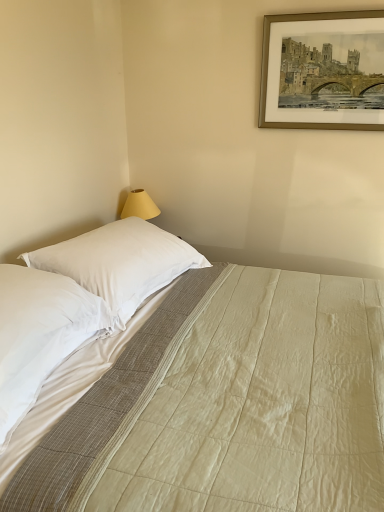
Question: From the image's perspective, is white soft pillow at left, arranged as the first pillow when viewed from the front, located beneath white cotton bed at center?

Choices:
 (A) yes
 (B) no

Answer: (B)

Question: Is the position of white soft pillow at left, which is counted as the 2th pillow, starting from the back, more distant than that of white cotton bed at center?

Choices:
 (A) yes
 (B) no

Answer: (A)

Question: Is white soft pillow at left, arranged as the first pillow when viewed from the front, beside white cotton bed at center?

Choices:
 (A) yes
 (B) no

Answer: (B)

Question: Could you tell me if white soft pillow at left, which is counted as the 2th pillow, starting from the back, is turned towards white cotton bed at center?

Choices:
 (A) yes
 (B) no

Answer: (A)

Question: Considering the relative positions of white soft pillow at left, which is counted as the 2th pillow, starting from the back, and white cotton bed at center in the image provided, is white soft pillow at left, which is counted as the 2th pillow, starting from the back, to the left of white cotton bed at center from the viewer's perspective?

Choices:
 (A) yes
 (B) no

Answer: (A)

Question: Is white soft pillow at left, which is counted as the 2th pillow, starting from the back, bigger than white cotton bed at center?

Choices:
 (A) yes
 (B) no

Answer: (B)

Question: Can white smooth pillow at upper left, which appears as the 2th pillow when viewed from the front, be found inside gold metallic picture frame at upper right?

Choices:
 (A) yes
 (B) no

Answer: (B)

Question: Does gold metallic picture frame at upper right have a greater height compared to white smooth pillow at upper left, which appears as the 2th pillow when viewed from the front?

Choices:
 (A) no
 (B) yes

Answer: (B)

Question: Does gold metallic picture frame at upper right have a greater width compared to white smooth pillow at upper left, which appears as the 2th pillow when viewed from the front?

Choices:
 (A) yes
 (B) no

Answer: (B)

Question: From the image's perspective, does gold metallic picture frame at upper right appear lower than white smooth pillow at upper left, the 1th pillow from the back?

Choices:
 (A) no
 (B) yes

Answer: (A)

Question: Does gold metallic picture frame at upper right have a lesser height compared to white smooth pillow at upper left, the 1th pillow from the back?

Choices:
 (A) yes
 (B) no

Answer: (B)

Question: Does gold metallic picture frame at upper right have a lesser width compared to white smooth pillow at upper left, the 1th pillow from the back?

Choices:
 (A) yes
 (B) no

Answer: (A)

Question: Is the depth of white cotton bed at center less than that of gold metallic picture frame at upper right?

Choices:
 (A) no
 (B) yes

Answer: (B)